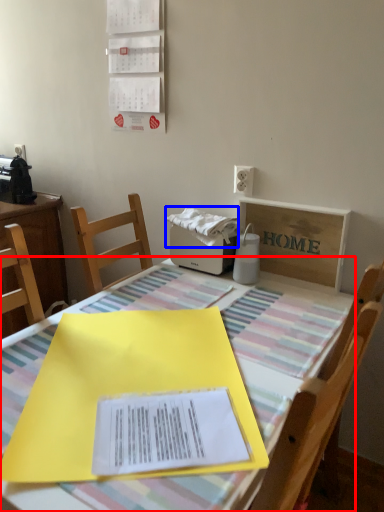
Question: Which of the following is the closest to the observer, table (highlighted by a red box) or fabric (highlighted by a blue box)?

Choices:
 (A) table
 (B) fabric

Answer: (A)